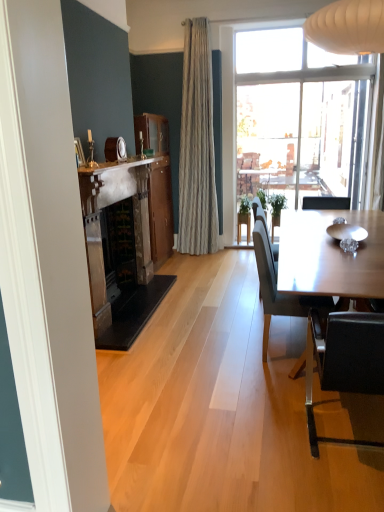
This screenshot has height=512, width=384. I want to click on free spot below black leather chair at lower right, which appears as the second chair when viewed from the back (from a real-world perspective), so pos(347,429).